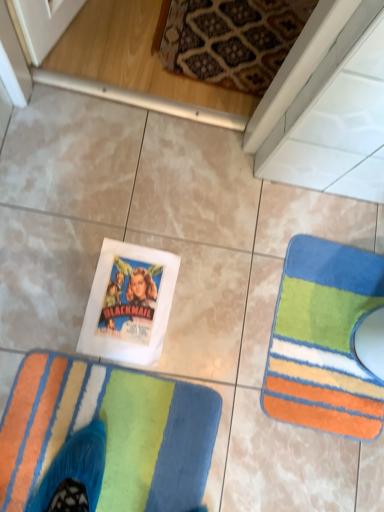
Where is `vacant space situated above multicolored plush rug at lower right, the first towel in the back-to-front sequence (from a real-world perspective)`? This screenshot has height=512, width=384. vacant space situated above multicolored plush rug at lower right, the first towel in the back-to-front sequence (from a real-world perspective) is located at coordinates (x=334, y=334).